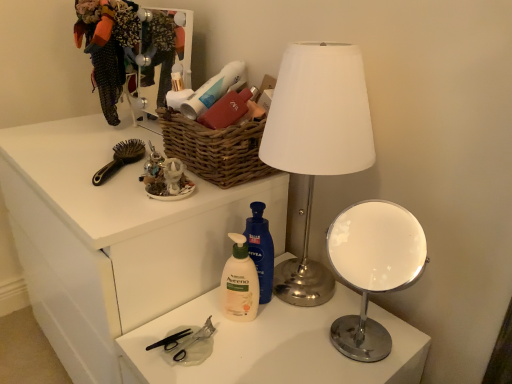
Question: Could you tell me if metallic silver lamp at center is turned towards white matte lotion at center, which appears as the 2th cleaning product when viewed from the right?

Choices:
 (A) yes
 (B) no

Answer: (A)

Question: Is metallic silver lamp at center at the left side of white matte lotion at center, which is counted as the first cleaning product, starting from the left?

Choices:
 (A) yes
 (B) no

Answer: (B)

Question: Are metallic silver lamp at center and white matte lotion at center, which is counted as the first cleaning product, starting from the left, located far from each other?

Choices:
 (A) no
 (B) yes

Answer: (A)

Question: From the image's perspective, is metallic silver lamp at center located beneath white matte lotion at center, which is counted as the first cleaning product, starting from the left?

Choices:
 (A) yes
 (B) no

Answer: (B)

Question: Is metallic silver lamp at center further to camera compared to white matte lotion at center, which is counted as the first cleaning product, starting from the left?

Choices:
 (A) yes
 (B) no

Answer: (B)

Question: Is metallic silver lamp at center smaller than white matte lotion at center, which appears as the 2th cleaning product when viewed from the right?

Choices:
 (A) yes
 (B) no

Answer: (B)

Question: From the image's perspective, is chrome/metallic table lamp at right below black plastic scissors at lower center?

Choices:
 (A) no
 (B) yes

Answer: (A)

Question: From a real-world perspective, is chrome/metallic table lamp at right below black plastic scissors at lower center?

Choices:
 (A) no
 (B) yes

Answer: (A)

Question: Does chrome/metallic table lamp at right have a lesser width compared to black plastic scissors at lower center?

Choices:
 (A) no
 (B) yes

Answer: (A)

Question: Is chrome/metallic table lamp at right to the right of black plastic scissors at lower center from the viewer's perspective?

Choices:
 (A) yes
 (B) no

Answer: (A)

Question: Is chrome/metallic table lamp at right outside black plastic scissors at lower center?

Choices:
 (A) yes
 (B) no

Answer: (A)

Question: Is chrome/metallic table lamp at right closer to the viewer compared to black plastic scissors at lower center?

Choices:
 (A) no
 (B) yes

Answer: (B)

Question: Considering the relative sizes of white matte desk at center and black plastic brush at upper left in the image provided, is white matte desk at center shorter than black plastic brush at upper left?

Choices:
 (A) yes
 (B) no

Answer: (B)